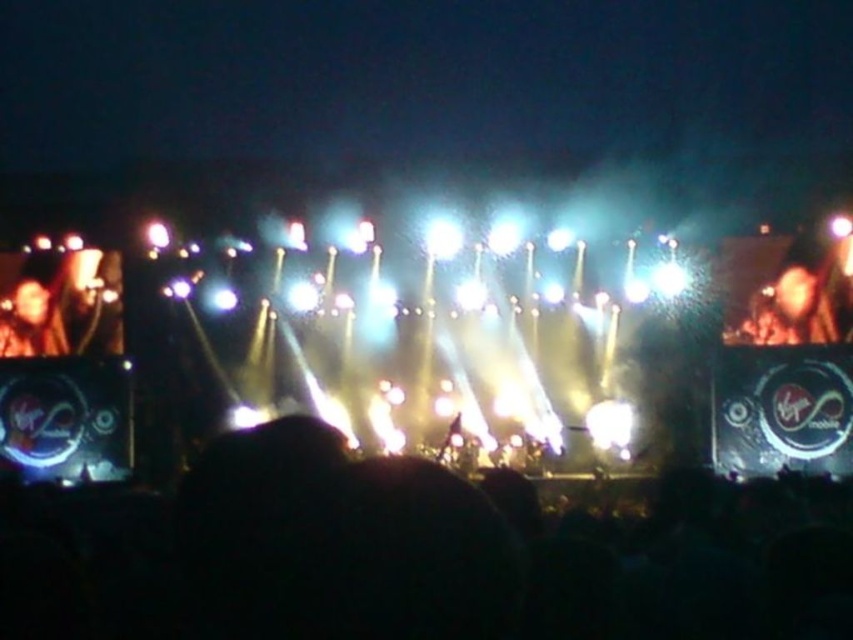
Can you confirm if dark brown leather jacket at upper right is thinner than smooth skin face at left?

In fact, dark brown leather jacket at upper right might be wider than smooth skin face at left.

Is point (767, 248) positioned after point (0, 317)?

No, it is not.

Does point (775, 339) come closer to viewer compared to point (45, 326)?

Yes, it is in front of point (45, 326).

Find the location of `dark brown leather jacket at upper right`. dark brown leather jacket at upper right is located at coordinates point(796,294).

Can you confirm if black matte crowd at lower center is positioned to the left of smooth skin face at left?

No, black matte crowd at lower center is not to the left of smooth skin face at left.

Looking at this image, is black matte crowd at lower center above smooth skin face at left?

Incorrect, black matte crowd at lower center is not positioned above smooth skin face at left.

The height and width of the screenshot is (640, 853). What are the coordinates of `black matte crowd at lower center` in the screenshot? It's located at (416, 554).

Image resolution: width=853 pixels, height=640 pixels. What are the coordinates of `black matte crowd at lower center` in the screenshot? It's located at (416, 554).

Does black matte crowd at lower center appear on the left side of dark brown leather jacket at upper right?

Yes, black matte crowd at lower center is to the left of dark brown leather jacket at upper right.

Is point (440, 467) positioned behind point (756, 305)?

No, (440, 467) is closer to viewer.

Is point (508, 554) closer to viewer compared to point (813, 312)?

Yes, point (508, 554) is in front of point (813, 312).

Find the location of a particular element. The image size is (853, 640). black matte crowd at lower center is located at coordinates (416, 554).